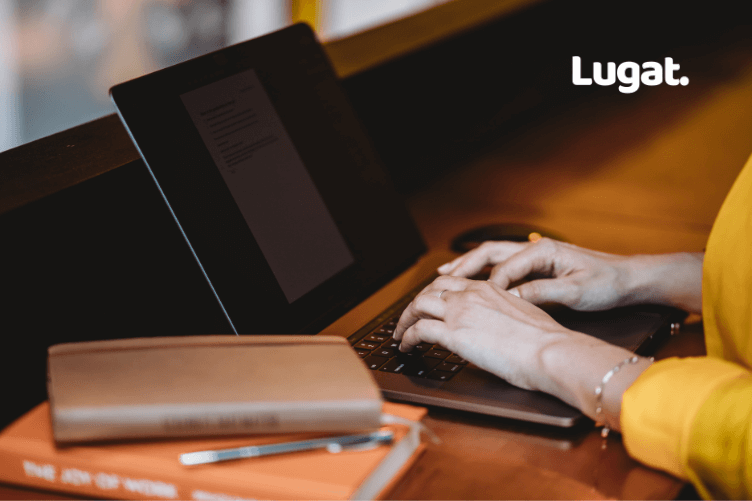
Help me find what monitor is leaning against in the image by pointing to them. Your answer should be formatted as a list of tuples, i.e. [(x1, y1), (x2, y2), ...], where each tuple contains the x and y coordinates of a point satisfying the conditions above.

[(114, 139)]